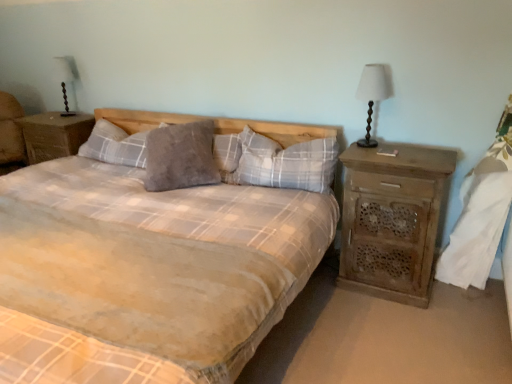
The height and width of the screenshot is (384, 512). I want to click on vacant space situated above rustic wood nightstand at right, acting as the second nightstand starting from the left (from a real-world perspective), so click(x=410, y=156).